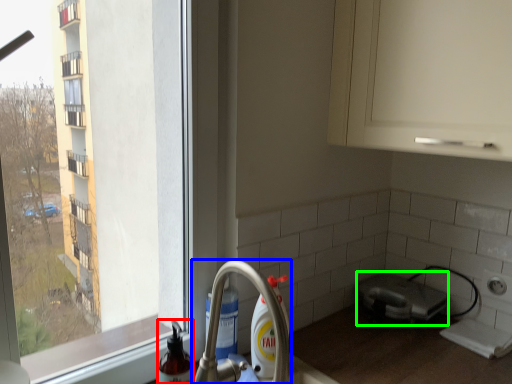
Question: Based on their relative distances, which object is farther from cleaning product (highlighted by a red box)? Choose from tap (highlighted by a blue box) and appliance (highlighted by a green box).

Choices:
 (A) tap
 (B) appliance

Answer: (B)